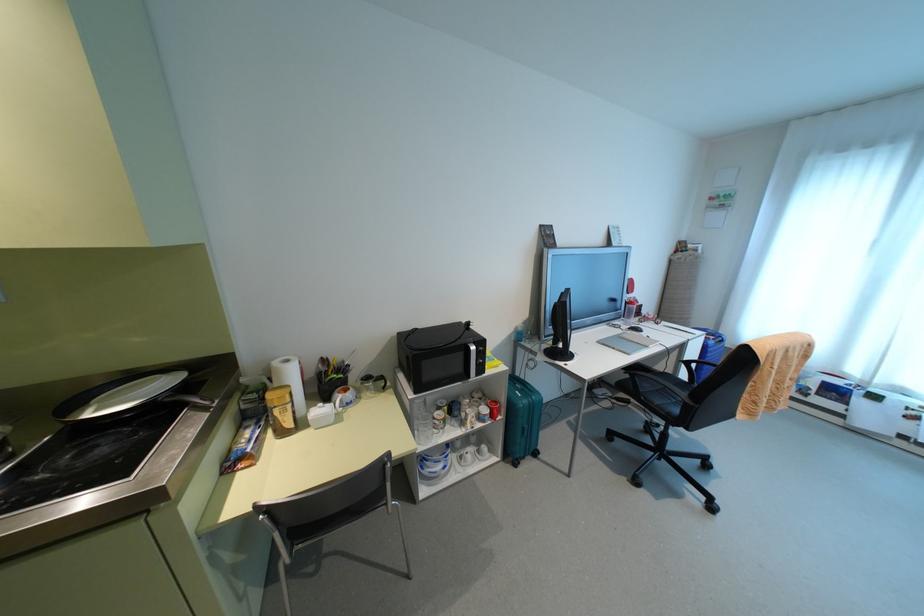
The height and width of the screenshot is (616, 924). What do you see at coordinates (655, 390) in the screenshot? I see `a black chair sitting surface` at bounding box center [655, 390].